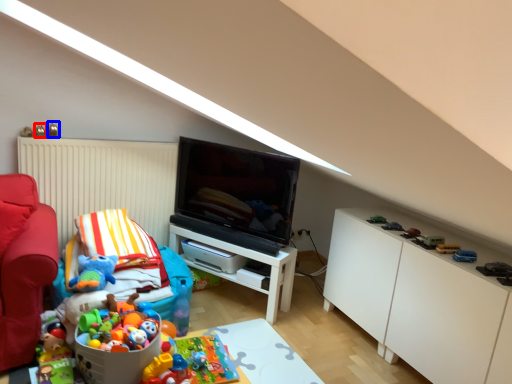
Question: Which object is closer to the camera taking this photo, toy (highlighted by a red box) or toy (highlighted by a blue box)?

Choices:
 (A) toy
 (B) toy

Answer: (A)